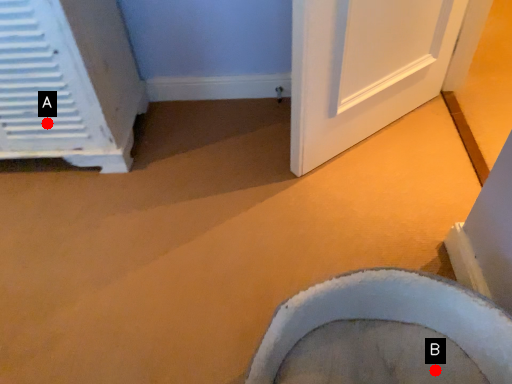
Question: Two points are circled on the image, labeled by A and B beside each circle. Which point is closer to the camera?

Choices:
 (A) A is closer
 (B) B is closer

Answer: (B)